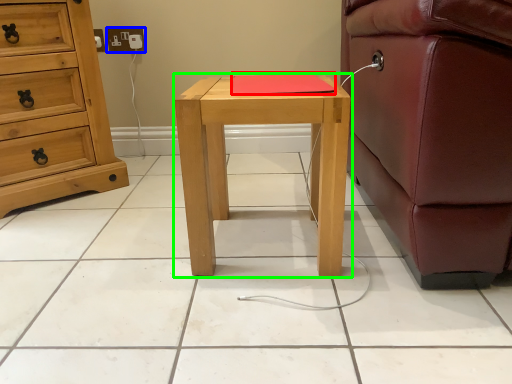
Question: Estimate the real-world distances between objects in this image. Which object is farther from pad (highlighted by a red box), electric outlet (highlighted by a blue box) or nightstand (highlighted by a green box)?

Choices:
 (A) electric outlet
 (B) nightstand

Answer: (A)